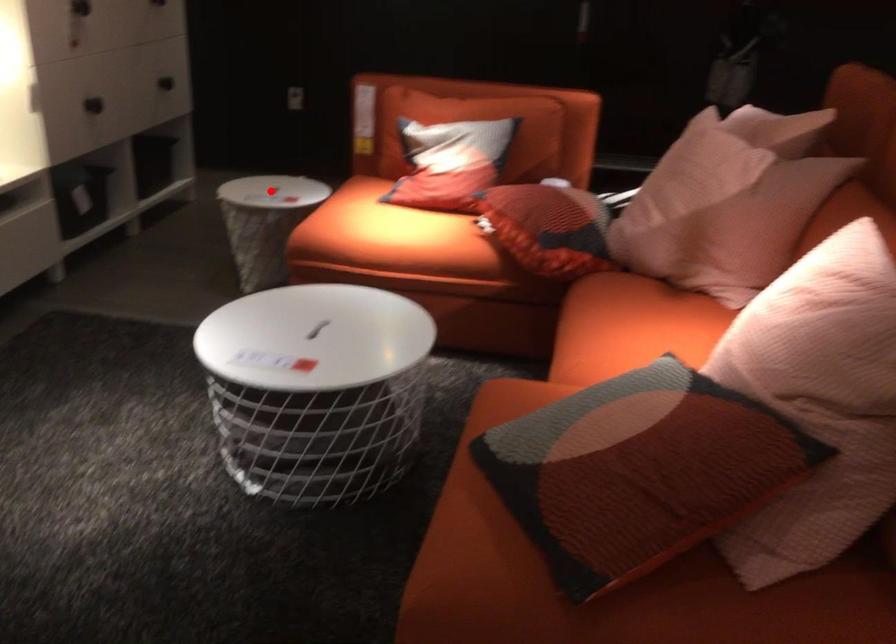
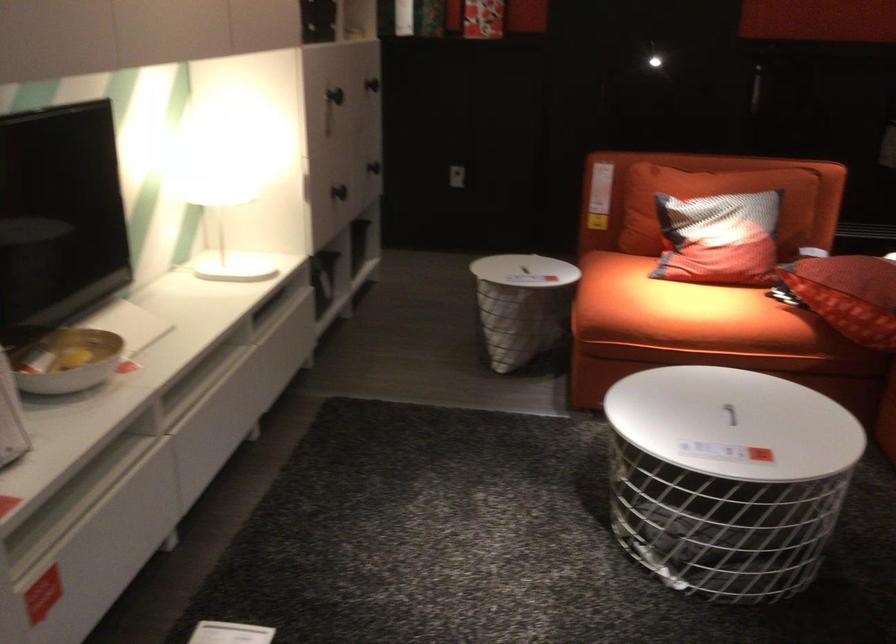
Find the pixel in the second image that matches the highlighted location in the first image.

(522, 270)